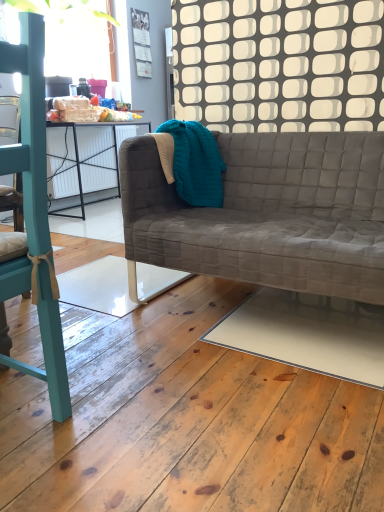
Question: From a real-world perspective, is white glossy plywood at lower center located beneath textured gray couch at center?

Choices:
 (A) yes
 (B) no

Answer: (A)

Question: Can you confirm if white glossy plywood at lower center is bigger than textured gray couch at center?

Choices:
 (A) yes
 (B) no

Answer: (B)

Question: Is textured gray couch at center inside white glossy plywood at lower center?

Choices:
 (A) no
 (B) yes

Answer: (A)

Question: Does white glossy plywood at lower center touch textured gray couch at center?

Choices:
 (A) yes
 (B) no

Answer: (B)

Question: Considering the relative positions of white glossy plywood at lower center and textured gray couch at center in the image provided, is white glossy plywood at lower center to the left of textured gray couch at center from the viewer's perspective?

Choices:
 (A) no
 (B) yes

Answer: (B)

Question: In terms of size, does teal painted wood chair at left appear bigger or smaller than textured gray couch at center?

Choices:
 (A) small
 (B) big

Answer: (A)

Question: Based on their positions, is teal painted wood chair at left located to the left or right of textured gray couch at center?

Choices:
 (A) left
 (B) right

Answer: (A)

Question: From a real-world perspective, is teal painted wood chair at left positioned above or below textured gray couch at center?

Choices:
 (A) above
 (B) below

Answer: (A)

Question: Is teal painted wood chair at left wider or thinner than textured gray couch at center?

Choices:
 (A) wide
 (B) thin

Answer: (B)

Question: From a real-world perspective, is white glossy plywood at lower center above or below teal knitted blanket at upper center?

Choices:
 (A) below
 (B) above

Answer: (A)

Question: Relative to teal knitted blanket at upper center, is white glossy plywood at lower center in front or behind?

Choices:
 (A) behind
 (B) front

Answer: (B)

Question: Looking at the image, does white glossy plywood at lower center seem bigger or smaller compared to teal knitted blanket at upper center?

Choices:
 (A) big
 (B) small

Answer: (A)

Question: From the image's perspective, relative to teal knitted blanket at upper center, is white glossy plywood at lower center above or below?

Choices:
 (A) below
 (B) above

Answer: (A)

Question: Visually, is teal painted wood chair at left positioned to the left or to the right of matte paper calendar at upper center?

Choices:
 (A) left
 (B) right

Answer: (B)

Question: Is teal painted wood chair at left in front of or behind matte paper calendar at upper center in the image?

Choices:
 (A) front
 (B) behind

Answer: (A)